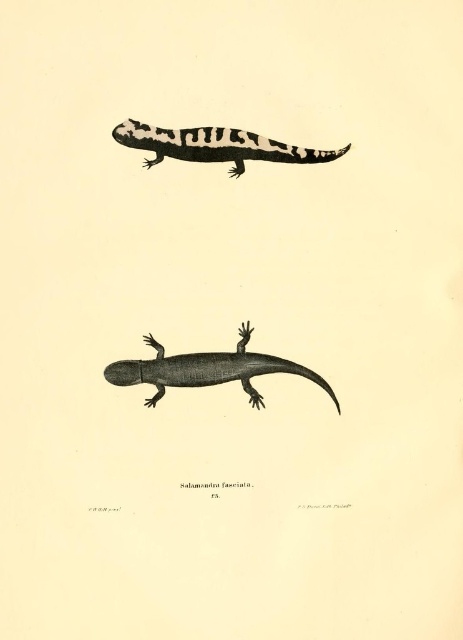
You are an animal researcher observing the two salamanders in the image. Which salamander, the gray textured salamander at center or the black and white striped salamander at upper center, appears closer to you?

The gray textured salamander at center appears closer because the black and white striped salamander at upper center is positioned behind it.

You are a biologist observing two salamanders in the image. The gray textured salamander at center and the black and white striped salamander at upper center. Which one is bigger in size?

The gray textured salamander at center is larger in size compared to the black and white striped salamander at upper center.